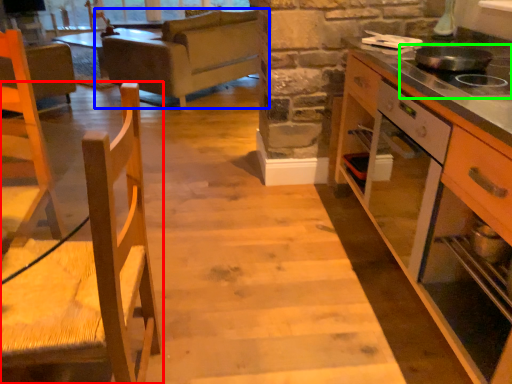
Question: Considering the real-world distances, which object is closest to chair (highlighted by a red box)? studio couch (highlighted by a blue box) or gas stove (highlighted by a green box).

Choices:
 (A) studio couch
 (B) gas stove

Answer: (B)